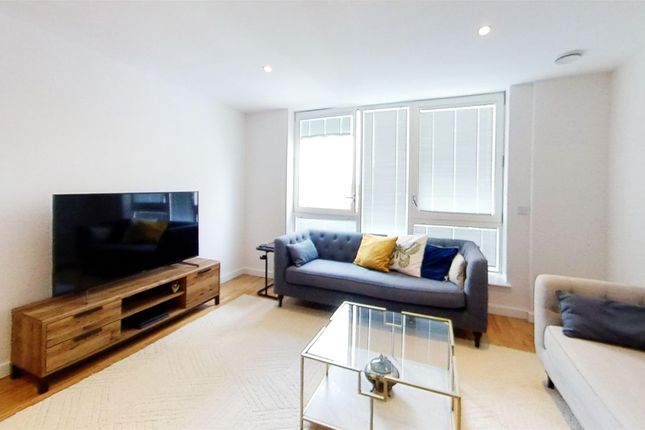
What are the coordinates of `reflective surface` in the screenshot? It's located at (353, 329), (137, 218).